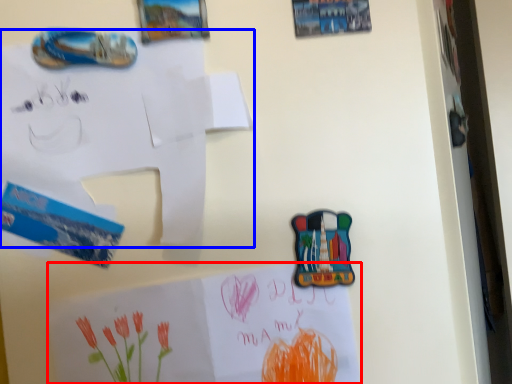
Question: Which point is further to the camera, paper (highlighted by a red box) or paper (highlighted by a blue box)?

Choices:
 (A) paper
 (B) paper

Answer: (A)